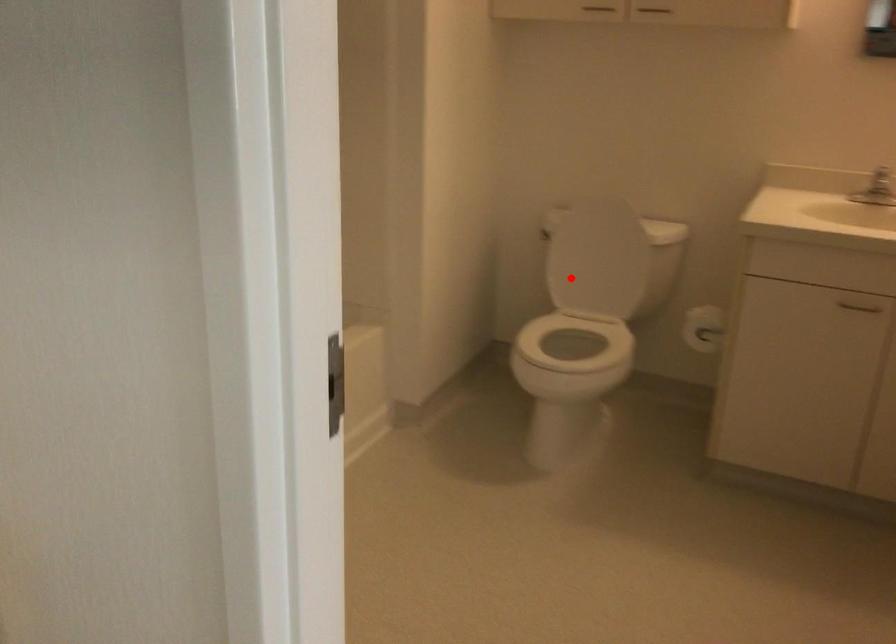
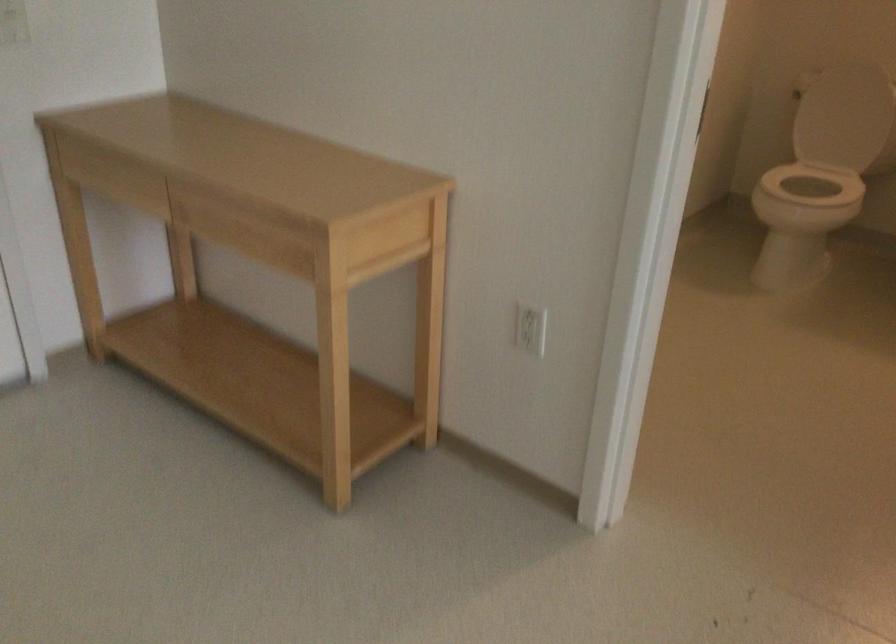
Where in the second image is the point corresponding to the highlighted location from the first image?

(839, 118)